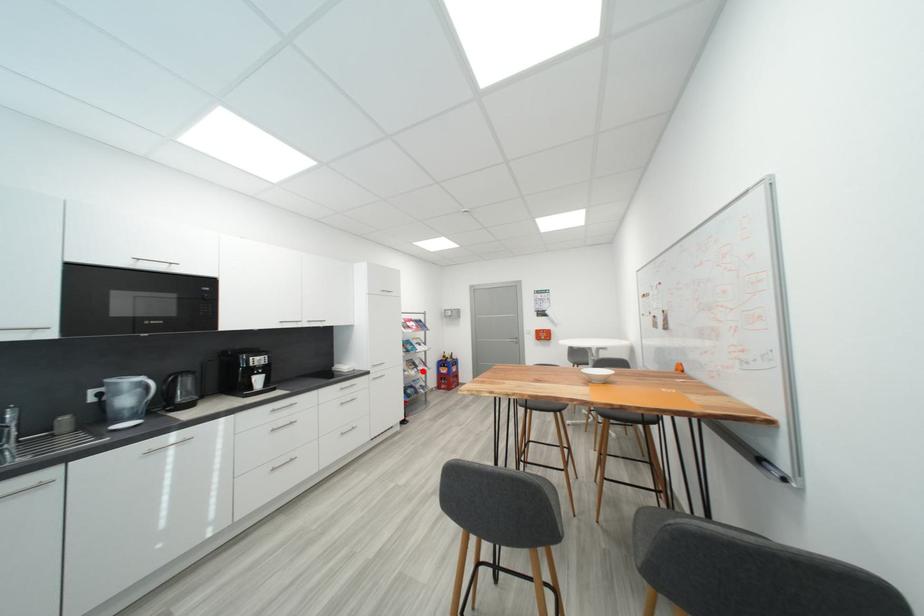
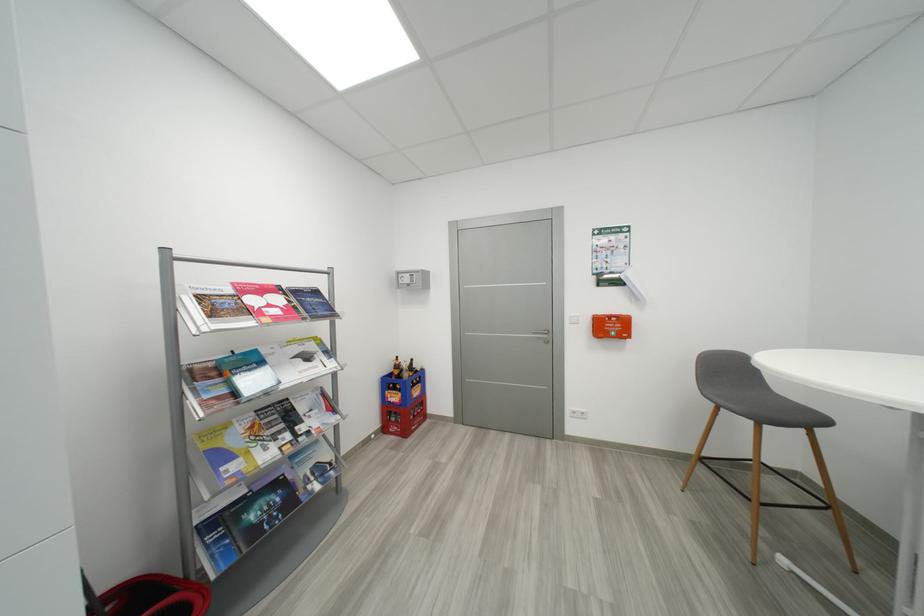
Find the pixel in the second image that matches the highlighted location in the first image.

(294, 438)